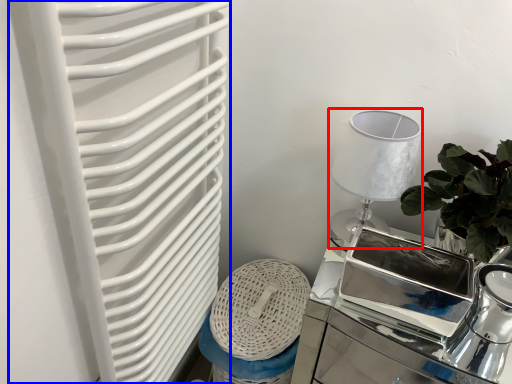
Question: Which point is closer to the camera, table lamp (highlighted by a red box) or radiator (highlighted by a blue box)?

Choices:
 (A) table lamp
 (B) radiator

Answer: (B)